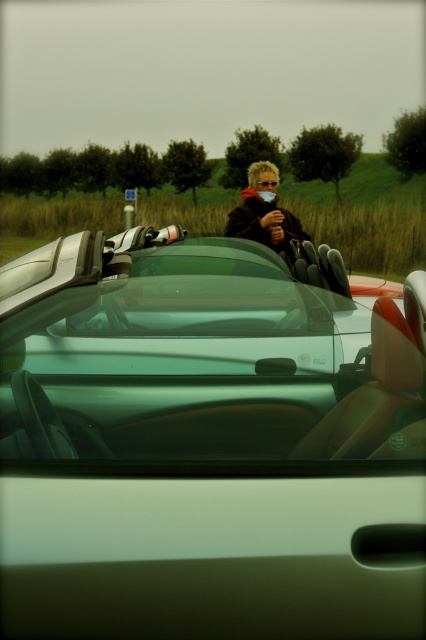
You are a photographer positioned 5 meters away from the convertible sports car. You want to take a picture of the matte black jacket at center without including the car in the frame. Is the jacket within your camera range if your camera can focus as close as 5 meters?

The distance of matte black jacket at center from viewer is 4.92 meters, which is within the camera focus range of 5 meters. Therefore, the photographer can take the picture without including the car in the frame.

You are standing in front of the convertible sports car and want to determine which of the two points, point (268,241) or point (270,179), is nearer to you. Based on the scene, which point is closer?

Point (268,241) is closer to the camera than point (270,179), so it is the nearer point.

You are a photographer trying to capture a clear shot of the metallic silver convertible at center and the translucent orange goggles at center. Since both are at the center, which object should you focus on first to ensure the other is also in focus?

The metallic silver convertible at center is taller than the translucent orange goggles at center. Focus on the taller object first to ensure the shorter one is also in focus.